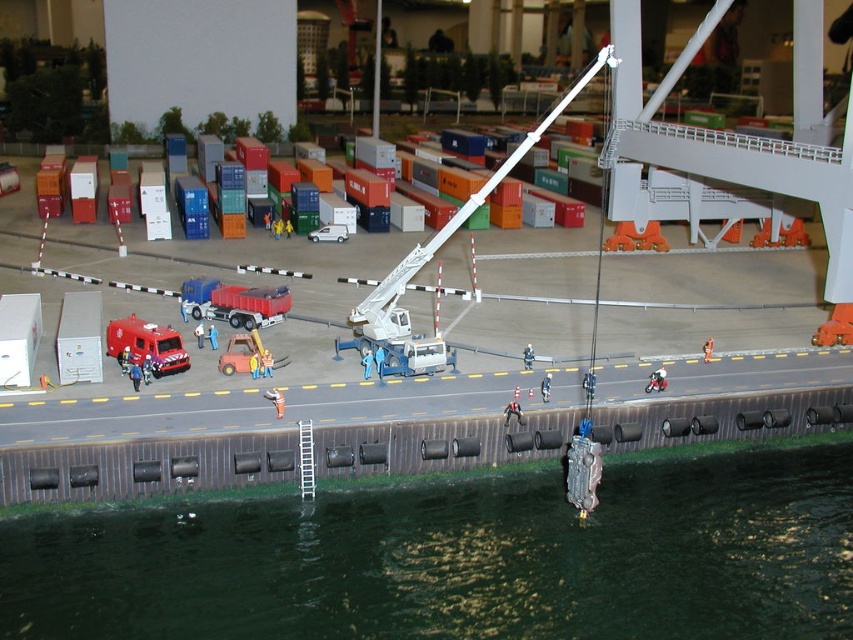
Who is positioned more to the right, orange matte lifebuoy at center or orange rubber boat at center?

From the viewer's perspective, orange rubber boat at center appears more on the right side.

Is orange matte lifebuoy at center below orange rubber boat at center?

No.

This screenshot has height=640, width=853. Identify the location of orange matte lifebuoy at center. (635, 237).

Who is more distant from viewer, (798, 244) or (648, 385)?

Positioned behind is point (798, 244).

Does point (775, 244) lie behind point (654, 381)?

Yes.

I want to click on orange rubber boat at center, so click(x=780, y=234).

Does point (233, 362) come behind point (773, 244)?

No.

Is the position of matte red truck at center less distant than that of orange rubber boat at center?

That is True.

Where is `matte red truck at center`? matte red truck at center is located at coordinates (241, 353).

Find the location of a particular element. The width and height of the screenshot is (853, 640). matte red truck at center is located at coordinates (241, 353).